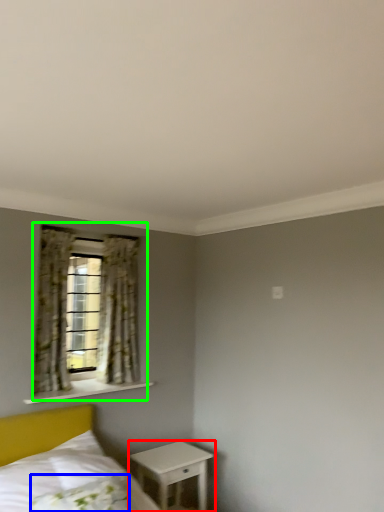
Question: Which object is positioned closest to nightstand (highlighted by a red box)? Select from pillow (highlighted by a blue box) and window (highlighted by a green box).

Choices:
 (A) pillow
 (B) window

Answer: (A)